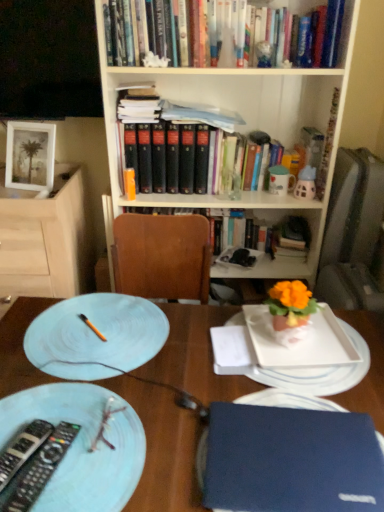
Where is `vacant space behind black plastic remote control at lower left`? vacant space behind black plastic remote control at lower left is located at coordinates (74, 400).